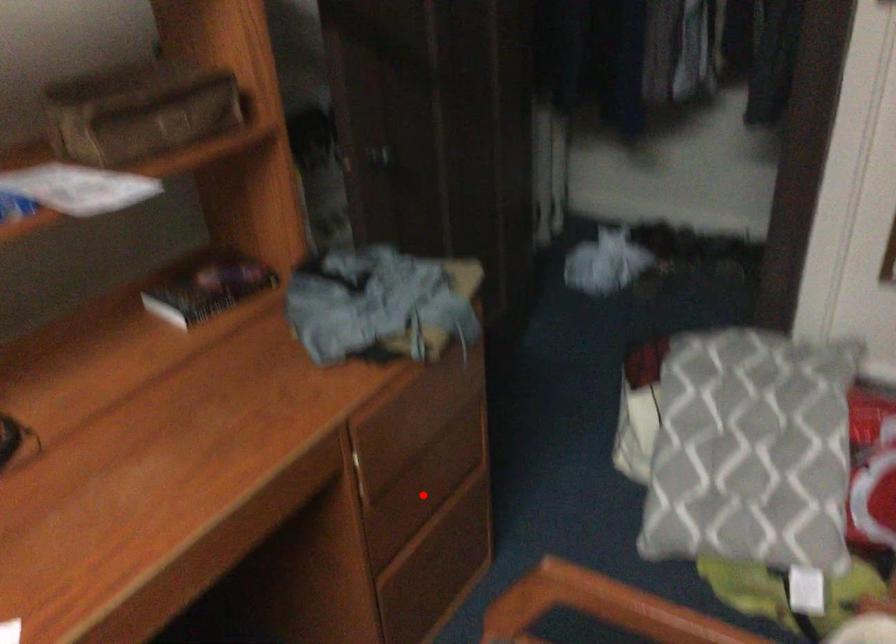
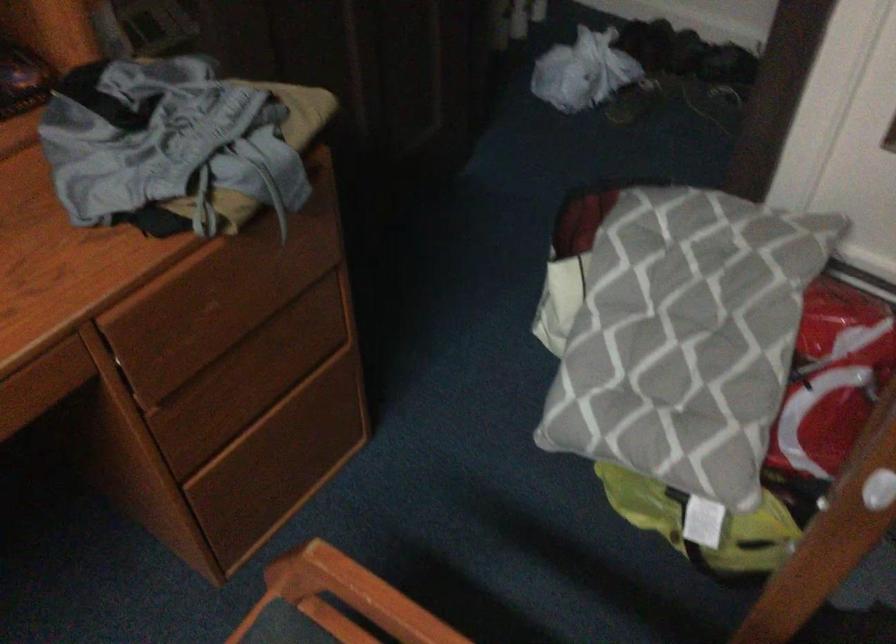
Locate, in the second image, the point that corresponds to the highlighted location in the first image.

(254, 377)